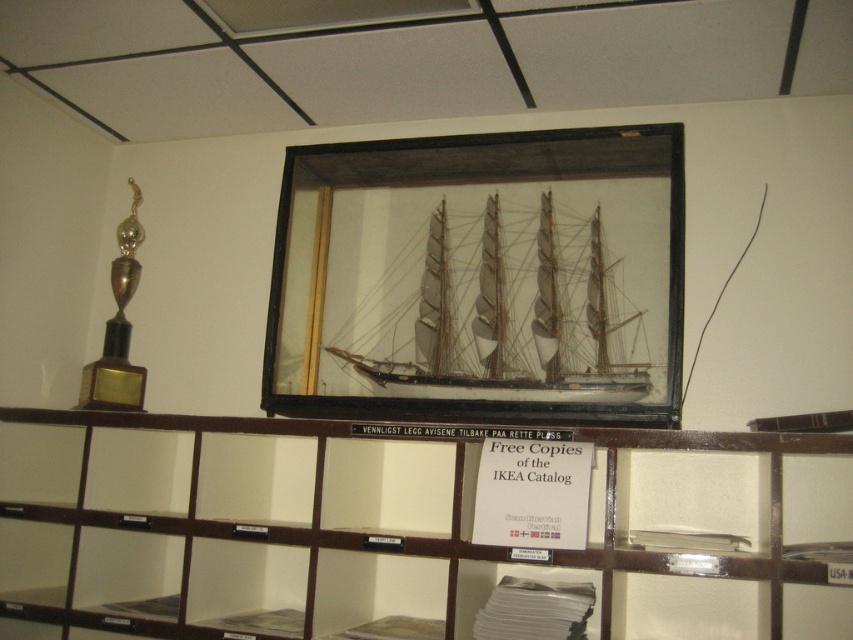
Is wooden ship at center to the left of gold polished trophy at left from the viewer's perspective?

In fact, wooden ship at center is to the right of gold polished trophy at left.

Who is lower down, wooden ship at center or gold polished trophy at left?

Positioned lower is gold polished trophy at left.

Find the location of a particular element. The image size is (853, 640). wooden ship at center is located at coordinates (486, 300).

Locate an element on the screen. This screenshot has height=640, width=853. wooden ship at center is located at coordinates (486, 300).

Between point (331, 628) and point (395, 273), which one is positioned behind?

The point (395, 273) is behind.

Can you confirm if wooden at center is smaller than wooden ship at center?

No.

Between point (65, 515) and point (447, 253), which one is positioned in front?

Positioned in front is point (65, 515).

The width and height of the screenshot is (853, 640). I want to click on wooden at center, so click(x=383, y=529).

Does wooden at center lie in front of gold polished trophy at left?

Yes.

Which is behind, point (321, 433) or point (114, 349)?

The point (114, 349) is behind.

The image size is (853, 640). I want to click on wooden at center, so click(383, 529).